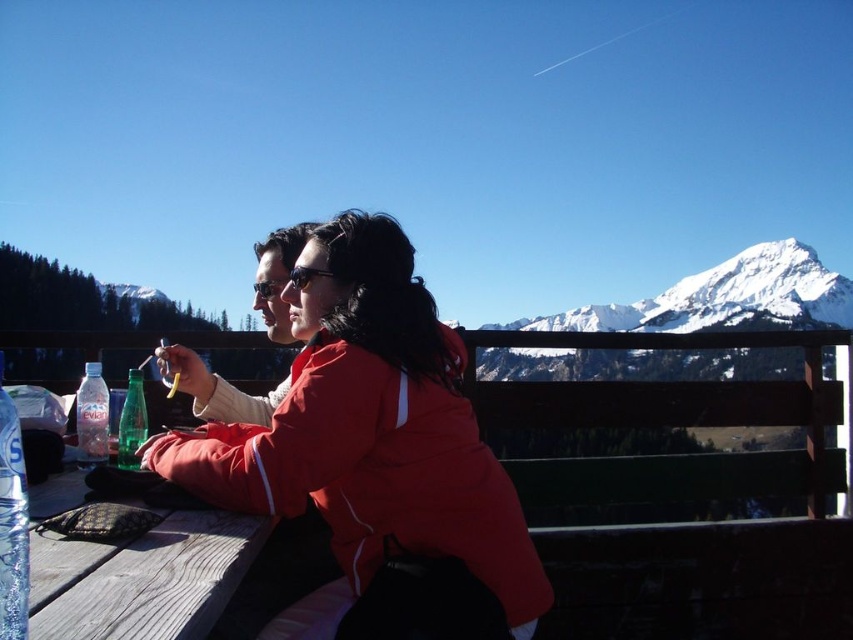
Question: Is clear plastic bottle at lower left above clear plastic bottle at table left?

Choices:
 (A) no
 (B) yes

Answer: (B)

Question: Which point is closer to the camera?

Choices:
 (A) (408, 499)
 (B) (138, 374)

Answer: (A)

Question: Which object is positioned closest to the clear plastic bottle at table left?

Choices:
 (A) wooden table at lower left
 (B) green glass bottle at lower left
 (C) clear plastic bottle at lower left

Answer: (B)

Question: Which point is closer to the camera?

Choices:
 (A) clear plastic bottle at table left
 (B) matte red jacket at center
 (C) green glass bottle at lower left

Answer: (B)

Question: Where is matte red jacket at center located in relation to clear plastic bottle at lower left in the image?

Choices:
 (A) above
 (B) below

Answer: (B)

Question: Does matte red jacket at center have a smaller size compared to wooden table at lower left?

Choices:
 (A) no
 (B) yes

Answer: (A)